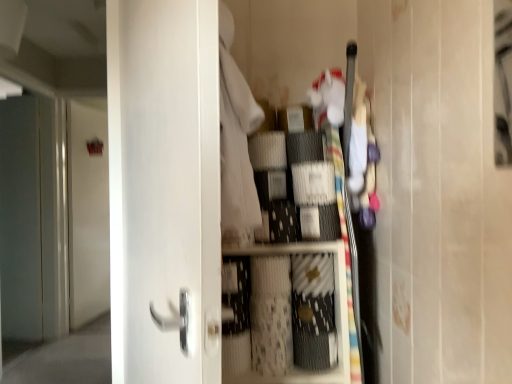
Where is `white matte door at upper left, placed as the first door when sorted from left to right`? white matte door at upper left, placed as the first door when sorted from left to right is located at coordinates (87, 213).

This screenshot has width=512, height=384. What do you see at coordinates (164, 190) in the screenshot? I see `white glossy door at center, which is counted as the first door, starting from the front` at bounding box center [164, 190].

Identify the location of matte gray screen door at left. tap(33, 218).

From the image's perspective, is white matte drawer at center positioned above or below white glossy door at center, which appears as the first door when viewed from the right?

Based on their image positions, white matte drawer at center is located beneath white glossy door at center, which appears as the first door when viewed from the right.

Are white matte drawer at center and white glossy door at center, which is counted as the second door, starting from the back, located far from each other?

No, white matte drawer at center is in close proximity to white glossy door at center, which is counted as the second door, starting from the back.

From a real-world perspective, is white matte drawer at center positioned above or below white glossy door at center, which is counted as the 2th door, starting from the left?

white matte drawer at center is below white glossy door at center, which is counted as the 2th door, starting from the left.

Is white matte drawer at center inside or outside of white glossy door at center, which appears as the first door when viewed from the right?

white matte drawer at center is not enclosed by white glossy door at center, which appears as the first door when viewed from the right.

In the image, is white matte drawer at center positioned in front of or behind matte gray screen door at left?

white matte drawer at center is positioned closer to the viewer than matte gray screen door at left.

Which is more to the right, white matte drawer at center or matte gray screen door at left?

From the viewer's perspective, white matte drawer at center appears more on the right side.

Between white matte drawer at center and matte gray screen door at left, which one has smaller width?

matte gray screen door at left is thinner.

From a real-world perspective, is white matte drawer at center on matte gray screen door at left?

No, from a real-world perspective, white matte drawer at center is not above matte gray screen door at left.

Is white matte drawer at center looking in the opposite direction of white matte door at upper left, placed as the first door when sorted from left to right?

No, white matte door at upper left, placed as the first door when sorted from left to right, is not at the back of white matte drawer at center.

From the image's perspective, which one is positioned lower, white matte drawer at center or white matte door at upper left, the second door from the front?

white matte drawer at center.

In the image, is white matte drawer at center on the left side or the right side of white matte door at upper left, the second door from the front?

Based on their positions, white matte drawer at center is located to the right of white matte door at upper left, the second door from the front.

Considering the positions of points (262, 245) and (71, 173), is point (262, 245) closer to camera compared to point (71, 173)?

Yes, it is in front of point (71, 173).

The height and width of the screenshot is (384, 512). I want to click on door that appears in front of the matte gray screen door at left, so click(x=164, y=190).

From a real-world perspective, is white glossy door at center, which is counted as the second door, starting from the back, beneath matte gray screen door at left?

No, from a real-world perspective, white glossy door at center, which is counted as the second door, starting from the back, is not beneath matte gray screen door at left.

Are white glossy door at center, which is counted as the first door, starting from the front, and matte gray screen door at left beside each other?

No, white glossy door at center, which is counted as the first door, starting from the front, is not in contact with matte gray screen door at left.

From the image's perspective, between white glossy door at center, which appears as the first door when viewed from the right, and matte gray screen door at left, which one is located above?

white glossy door at center, which appears as the first door when viewed from the right, is shown above in the image.

Can you confirm if matte gray screen door at left is positioned to the right of white matte door at upper left, which is the 1th door in back-to-front order?

In fact, matte gray screen door at left is to the left of white matte door at upper left, which is the 1th door in back-to-front order.

In terms of height, does matte gray screen door at left look taller or shorter compared to white matte door at upper left, which is the 1th door in back-to-front order?

A: Clearly, matte gray screen door at left is taller compared to white matte door at upper left, which is the 1th door in back-to-front order.

From a real-world perspective, between matte gray screen door at left and white matte door at upper left, which is the 1th door in back-to-front order, who is vertically higher?

matte gray screen door at left is physically above.

Could you measure the distance between matte gray screen door at left and white matte door at upper left, the 2th door from the right?

matte gray screen door at left is 34.72 centimeters from white matte door at upper left, the 2th door from the right.

From a real-world perspective, is white glossy door at center, which is counted as the 2th door, starting from the left, physically below white matte door at upper left, the 2th door from the right?

No, from a real-world perspective, white glossy door at center, which is counted as the 2th door, starting from the left, is not beneath white matte door at upper left, the 2th door from the right.

Which object is positioned more to the right, white glossy door at center, which appears as the first door when viewed from the right, or white matte door at upper left, the 2th door from the right?

Positioned to the right is white glossy door at center, which appears as the first door when viewed from the right.

Which of these two, white glossy door at center, which is counted as the second door, starting from the back, or white matte door at upper left, placed as the first door when sorted from left to right, is smaller?

white matte door at upper left, placed as the first door when sorted from left to right.

From the image's perspective, between white glossy door at center, which is counted as the second door, starting from the back, and white matte door at upper left, the 2th door from the right, which one is located above?

white glossy door at center, which is counted as the second door, starting from the back, is shown above in the image.

Find the location of `door to the left of white glossy door at center, which is counted as the 2th door, starting from the left`. door to the left of white glossy door at center, which is counted as the 2th door, starting from the left is located at coordinates (87, 213).

Is white matte door at upper left, placed as the first door when sorted from left to right, not inside white glossy door at center, which is counted as the 2th door, starting from the left?

That's correct, white matte door at upper left, placed as the first door when sorted from left to right, is outside of white glossy door at center, which is counted as the 2th door, starting from the left.

Which is behind, point (70, 150) or point (152, 180)?

The point (70, 150) is behind.

The height and width of the screenshot is (384, 512). I want to click on the 2nd door positioned above the white matte drawer at center (from a real-world perspective), so click(x=164, y=190).

In the image, there is a matte gray screen door at left. Where is `cabinet below it (from a real-world perspective)`? cabinet below it (from a real-world perspective) is located at coordinates (335, 312).

From the picture: Which object lies nearer to the anchor point white glossy door at center, which appears as the first door when viewed from the right, white matte drawer at center or white matte door at upper left, placed as the first door when sorted from left to right?

white matte drawer at center is positioned closer to the anchor white glossy door at center, which appears as the first door when viewed from the right.

Based on their spatial positions, is white matte drawer at center or white matte door at upper left, which is the 1th door in back-to-front order, further from matte gray screen door at left?

white matte drawer at center is further to matte gray screen door at left.

Based on their spatial positions, is white matte door at upper left, placed as the first door when sorted from left to right, or matte gray screen door at left further from white glossy door at center, which is counted as the second door, starting from the back?

The object further to white glossy door at center, which is counted as the second door, starting from the back, is white matte door at upper left, placed as the first door when sorted from left to right.

Estimate the real-world distances between objects in this image. Which object is further from matte gray screen door at left, white matte door at upper left, the second door from the front, or white glossy door at center, which appears as the first door when viewed from the right?

white glossy door at center, which appears as the first door when viewed from the right, is positioned further to the anchor matte gray screen door at left.

Estimate the real-world distances between objects in this image. Which object is further from white glossy door at center, which is counted as the first door, starting from the front, white matte door at upper left, the second door from the front, or white matte drawer at center?

Among the two, white matte door at upper left, the second door from the front, is located further to white glossy door at center, which is counted as the first door, starting from the front.

Which object lies further to the anchor point white matte door at upper left, the second door from the front, white matte drawer at center or white glossy door at center, which is counted as the 2th door, starting from the left?

white matte drawer at center is further to white matte door at upper left, the second door from the front.

When comparing their distances from white matte drawer at center, does white glossy door at center, which is counted as the first door, starting from the front, or matte gray screen door at left seem further?

The object further to white matte drawer at center is matte gray screen door at left.

From the image, which object appears to be nearer to matte gray screen door at left, white glossy door at center, which is counted as the 2th door, starting from the left, or white matte door at upper left, placed as the first door when sorted from left to right?

The object closer to matte gray screen door at left is white matte door at upper left, placed as the first door when sorted from left to right.

This screenshot has height=384, width=512. In order to click on cabinet between white glossy door at center, which is counted as the second door, starting from the back, and matte gray screen door at left, along the z-axis in this screenshot , I will do `click(335, 312)`.

Where is `screen door between white matte drawer at center and white matte door at upper left, the 2th door from the right, along the z-axis`? Image resolution: width=512 pixels, height=384 pixels. screen door between white matte drawer at center and white matte door at upper left, the 2th door from the right, along the z-axis is located at coordinates (33, 218).

Find the location of a particular element. screen door located between white glossy door at center, which is counted as the 2th door, starting from the left, and white matte door at upper left, the second door from the front, in the depth direction is located at coordinates (33, 218).

Locate an element on the screen. Image resolution: width=512 pixels, height=384 pixels. cabinet positioned between white glossy door at center, which is counted as the second door, starting from the back, and white matte door at upper left, the second door from the front, from near to far is located at coordinates (335, 312).